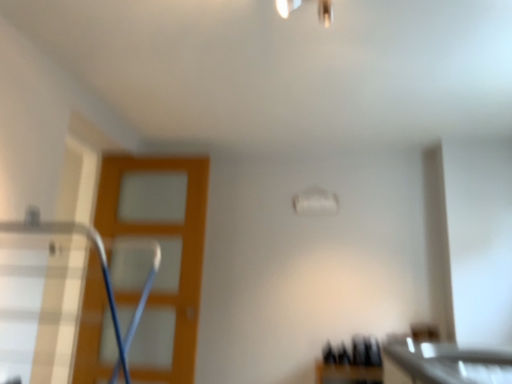
Question: From a real-world perspective, is orange wood screen door at left physically below metallic silver swivel chair at left?

Choices:
 (A) no
 (B) yes

Answer: (A)

Question: From a real-world perspective, is orange wood screen door at left over metallic silver swivel chair at left?

Choices:
 (A) yes
 (B) no

Answer: (A)

Question: Could metallic silver swivel chair at left be considered to be inside orange wood screen door at left?

Choices:
 (A) yes
 (B) no

Answer: (B)

Question: Considering the relative sizes of orange wood screen door at left and metallic silver swivel chair at left in the image provided, is orange wood screen door at left shorter than metallic silver swivel chair at left?

Choices:
 (A) no
 (B) yes

Answer: (A)

Question: Can you confirm if orange wood screen door at left is taller than metallic silver swivel chair at left?

Choices:
 (A) yes
 (B) no

Answer: (A)

Question: From a real-world perspective, is white glossy countertop at lower right positioned above or below orange wood screen door at left?

Choices:
 (A) above
 (B) below

Answer: (B)

Question: In terms of size, does white glossy countertop at lower right appear bigger or smaller than orange wood screen door at left?

Choices:
 (A) small
 (B) big

Answer: (A)

Question: Based on their positions, is white glossy countertop at lower right located to the left or right of orange wood screen door at left?

Choices:
 (A) left
 (B) right

Answer: (B)

Question: Is white glossy countertop at lower right spatially inside orange wood screen door at left, or outside of it?

Choices:
 (A) inside
 (B) outside

Answer: (B)

Question: Is orange wood screen door at left bigger or smaller than metallic silver swivel chair at left?

Choices:
 (A) small
 (B) big

Answer: (A)

Question: Looking at their shapes, would you say orange wood screen door at left is wider or thinner than metallic silver swivel chair at left?

Choices:
 (A) thin
 (B) wide

Answer: (A)

Question: From their relative heights in the image, would you say orange wood screen door at left is taller or shorter than metallic silver swivel chair at left?

Choices:
 (A) tall
 (B) short

Answer: (A)

Question: In the image, is orange wood screen door at left positioned in front of or behind metallic silver swivel chair at left?

Choices:
 (A) front
 (B) behind

Answer: (B)

Question: Is metallic silver swivel chair at left to the left or to the right of orange wood screen door at left in the image?

Choices:
 (A) left
 (B) right

Answer: (B)

Question: Based on their sizes in the image, would you say metallic silver swivel chair at left is bigger or smaller than orange wood screen door at left?

Choices:
 (A) big
 (B) small

Answer: (A)